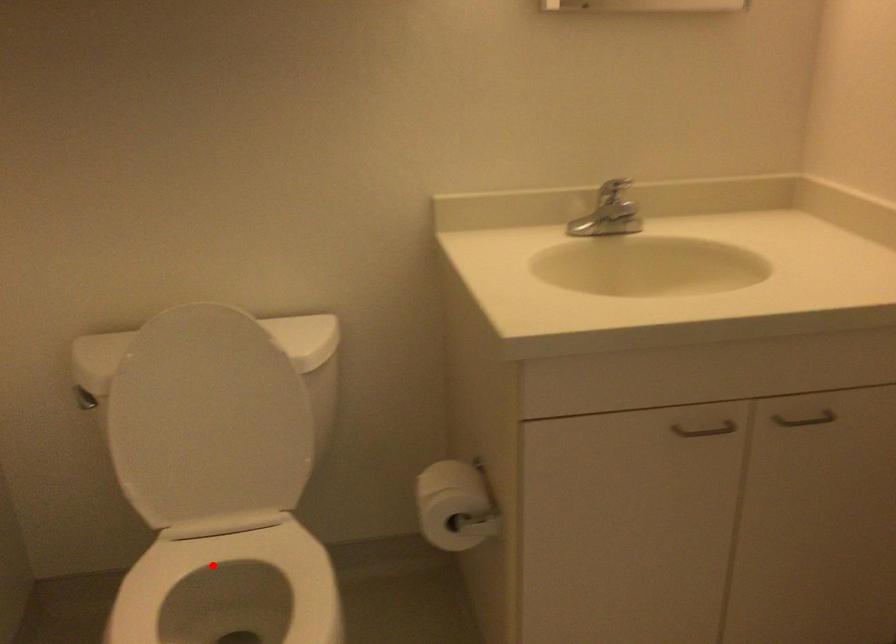
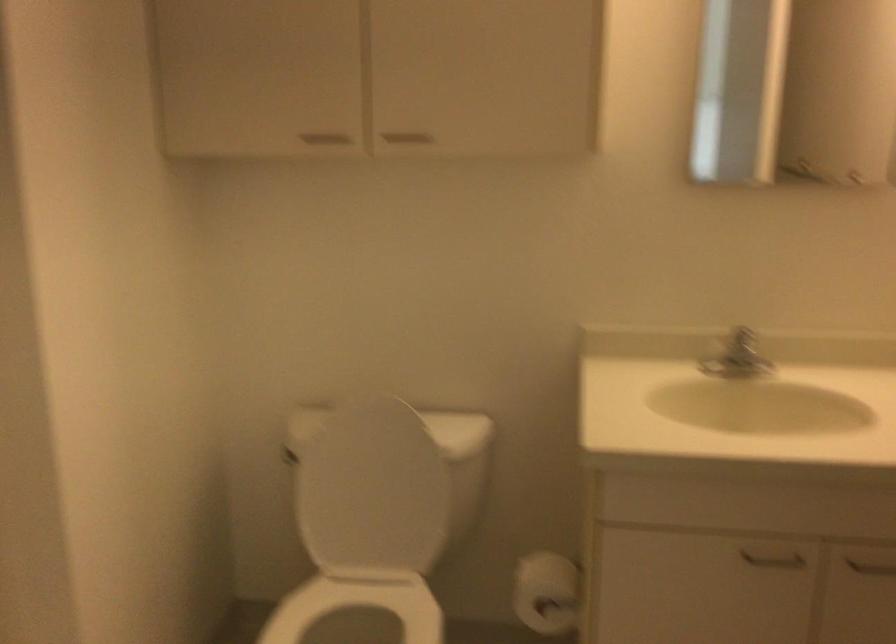
Find the pixel in the second image that matches the highlighted location in the first image.

(357, 605)